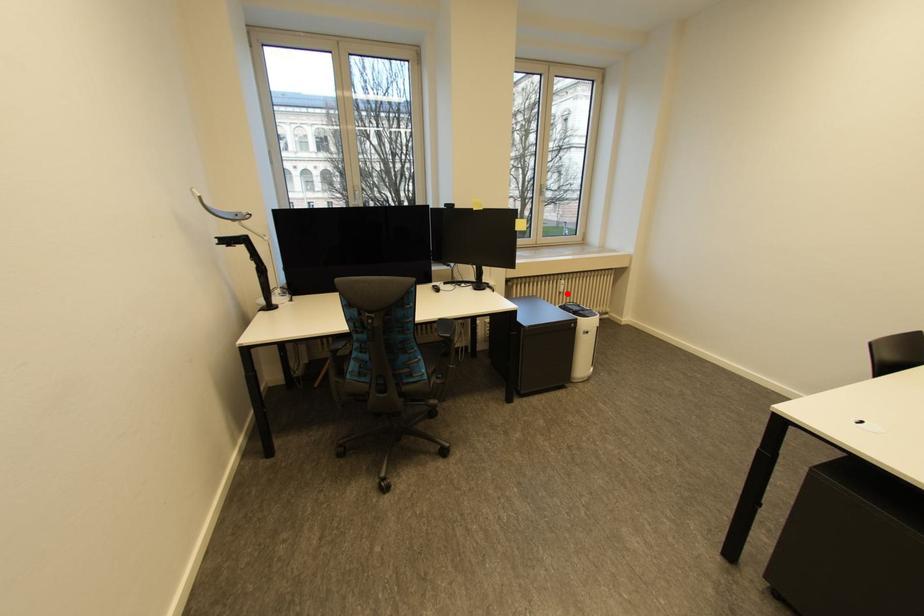
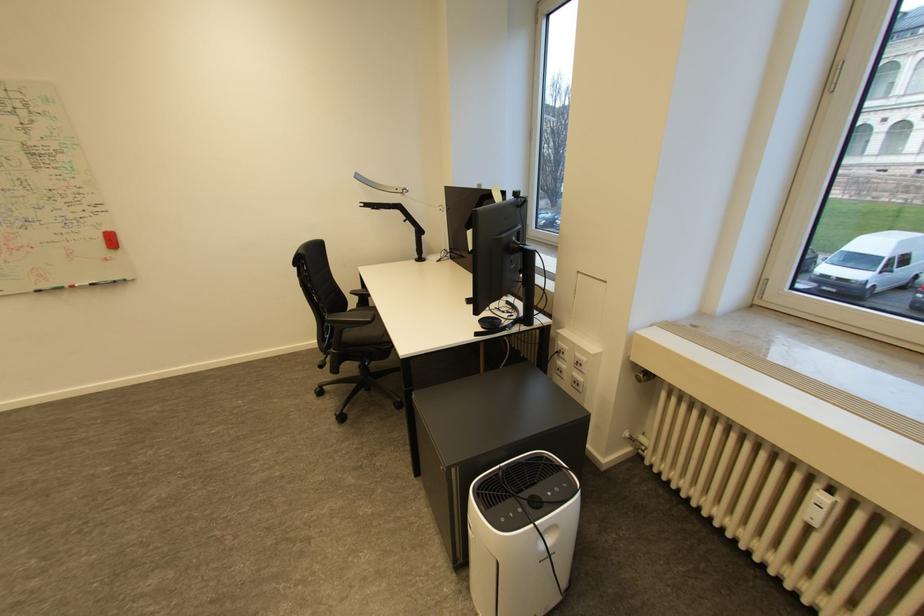
The point at the highlighted location is marked in the first image. Where is the corresponding point in the second image?

(816, 525)